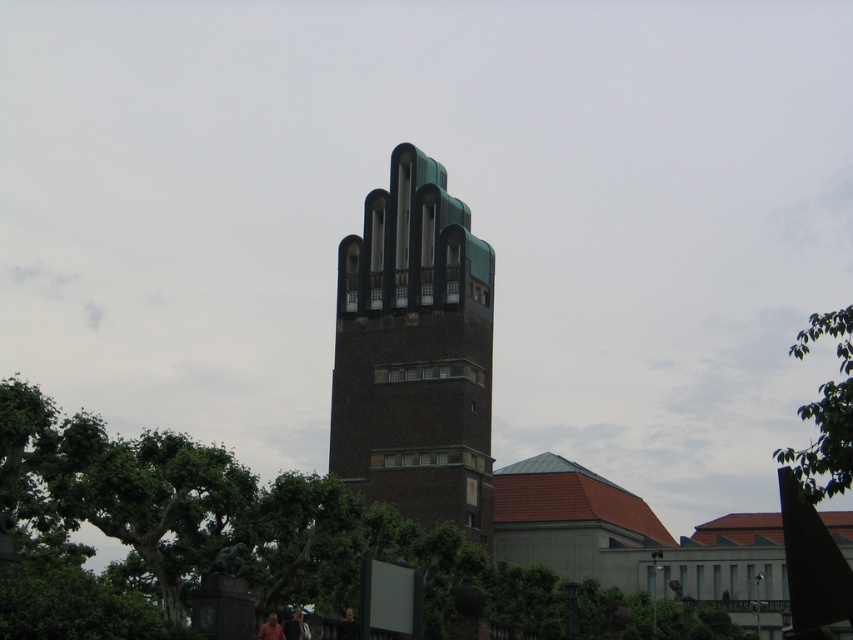
Question: Which of these objects is positioned closest to the green leafy tree at upper right?

Choices:
 (A) green leafy tree at center
 (B) brown brick tower at center

Answer: (B)

Question: From the image, what is the correct spatial relationship of green leafy tree at center in relation to brown brick tower at center?

Choices:
 (A) above
 (B) below

Answer: (B)

Question: Among these objects, which one is farthest from the camera?

Choices:
 (A) green leafy tree at upper right
 (B) green leafy tree at center

Answer: (A)

Question: Does green leafy tree at center appear on the left side of brown brick tower at center?

Choices:
 (A) yes
 (B) no

Answer: (A)

Question: Does green leafy tree at center have a lesser width compared to green leafy tree at upper right?

Choices:
 (A) yes
 (B) no

Answer: (B)

Question: Which of the following is the farthest from the observer?

Choices:
 (A) green leafy tree at center
 (B) brown brick tower at center

Answer: (B)